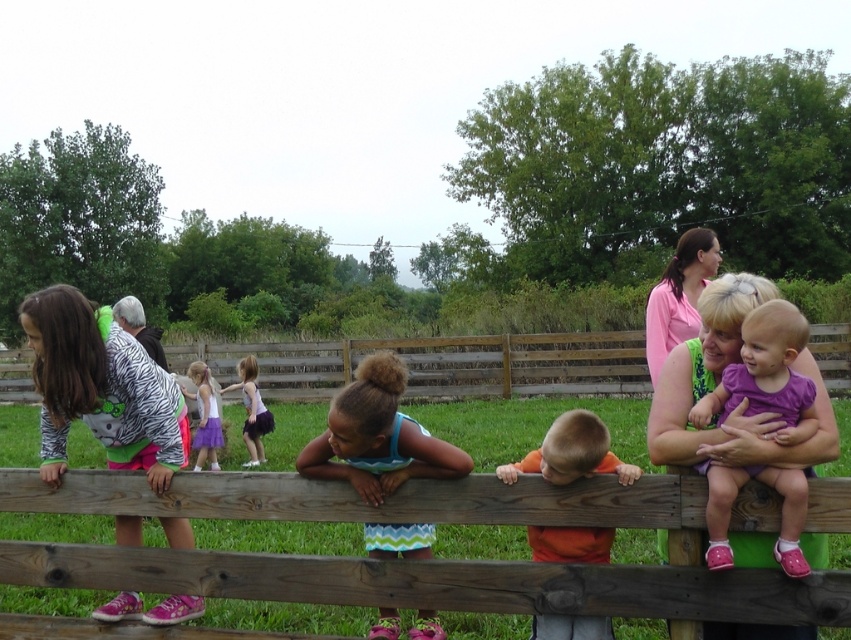
You are a photographer trying to capture a photo of the zebra print hoodie at left and the orange matte shirt at center. Based on their positions, which one should you focus on first if you want to include both in the frame without moving the camera?

The zebra print hoodie at left is to the left of orange matte shirt at center, so you should focus on the zebra print hoodie at left first to ensure both are in the frame without moving the camera.

You are a photographer trying to capture a photo of both the light purple dress at center and the white cotton dress at center. Since you can only focus on one dress at a time, which dress should you focus on first to ensure the other is still in the background?

The light purple dress at center is closer to the viewer than the white cotton dress at center, so you should focus on the light purple dress at center first. This way, the white cotton dress at center will remain in the background when the light purple dress at center is in focus.

You are a photographer trying to capture a candid shot of the purple fabric baby at center and the orange matte shirt at center. If your camera has a depth of field that can focus on objects within 18 inches of each other, will both subjects be in focus?

The purple fabric baby at center is 18.25 inches from the orange matte shirt at center. Since the distance between them is slightly more than 18 inches, the camera might not be able to keep both in focus simultaneously.